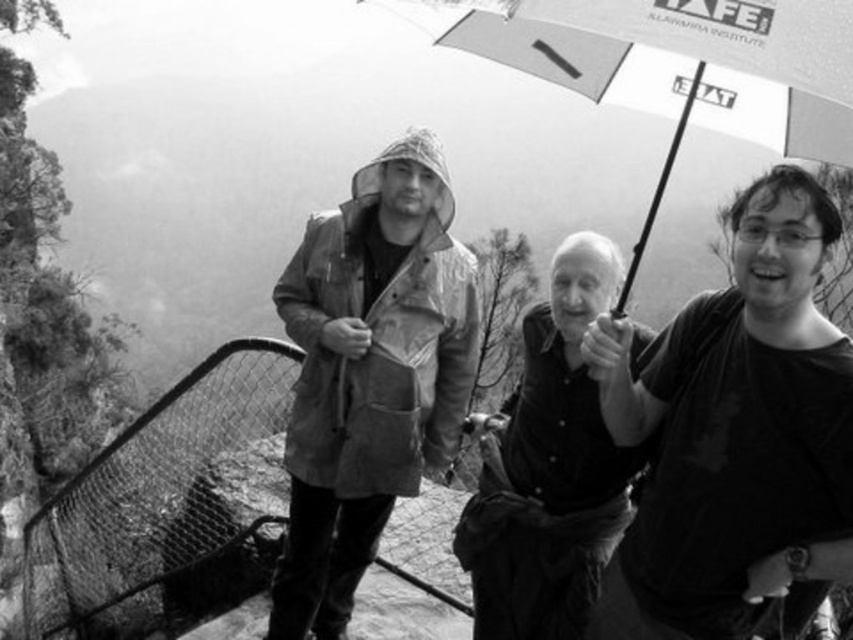
Does waterproof fabric jacket at center have a lesser width compared to white fabric umbrella at center?

Correct, waterproof fabric jacket at center's width is less than white fabric umbrella at center's.

The image size is (853, 640). I want to click on waterproof fabric jacket at center, so click(x=369, y=374).

Measure the distance between point (314, 248) and camera.

They are 40.19 feet apart.

I want to click on waterproof fabric jacket at center, so click(x=369, y=374).

Does metal mesh rope bridge at center have a lesser height compared to white fabric umbrella at center?

No.

Measure the distance between metal mesh rope bridge at center and camera.

metal mesh rope bridge at center is 29.30 feet away from camera.

The image size is (853, 640). Identify the location of metal mesh rope bridge at center. (164, 502).

How distant is black matte t-shirt at right from white fabric umbrella at center?

black matte t-shirt at right is 5.79 feet from white fabric umbrella at center.

Measure the distance between black matte t-shirt at right and camera.

black matte t-shirt at right is 8.11 meters away from camera.

Where is `black matte t-shirt at right`? black matte t-shirt at right is located at coordinates (735, 433).